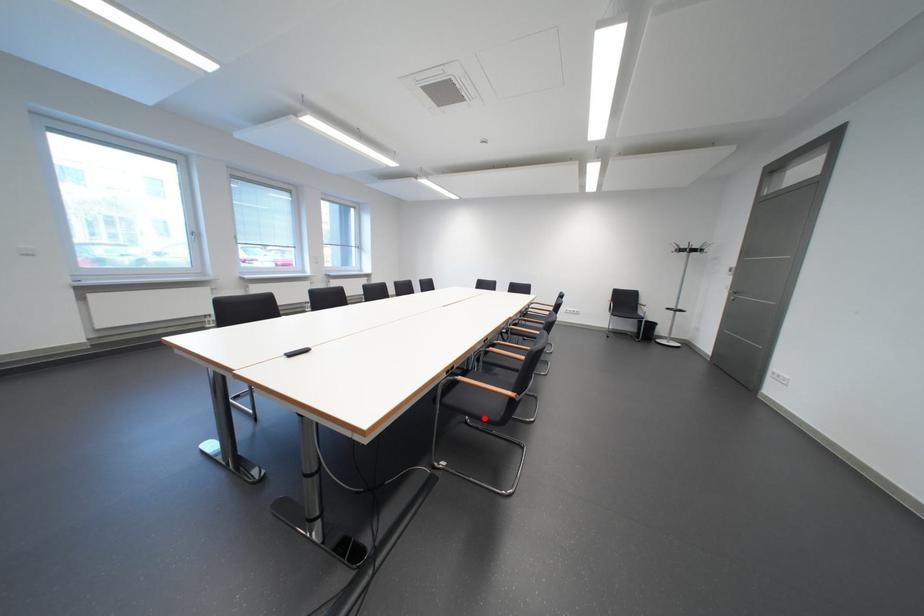
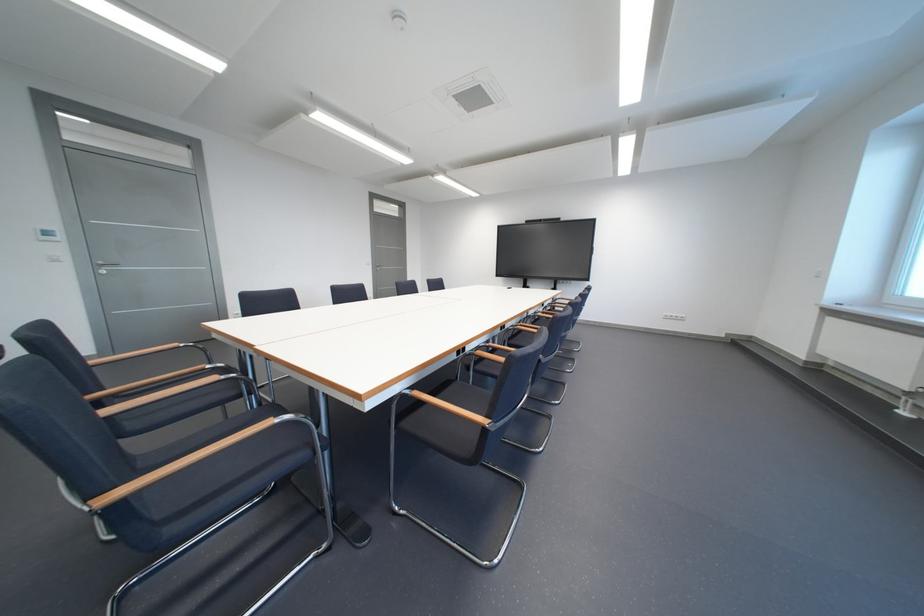
Question: I am providing you with two images of the same scene from different viewpoints. A red point is marked on the first image. Is the red point's position out of view in image 2?

Choices:
 (A) Yes
 (B) No

Answer: (A)